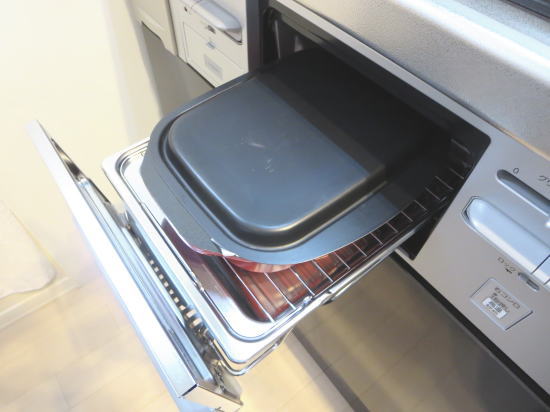
Locate an element on the screen. This screenshot has height=412, width=550. wood floor is located at coordinates (381, 349).